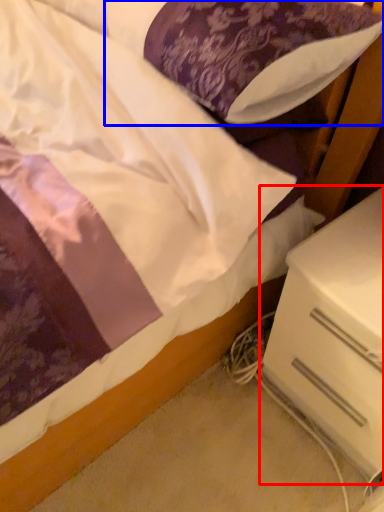
Question: Among these objects, which one is farthest to the camera, nightstand (highlighted by a red box) or pillow (highlighted by a blue box)?

Choices:
 (A) nightstand
 (B) pillow

Answer: (A)